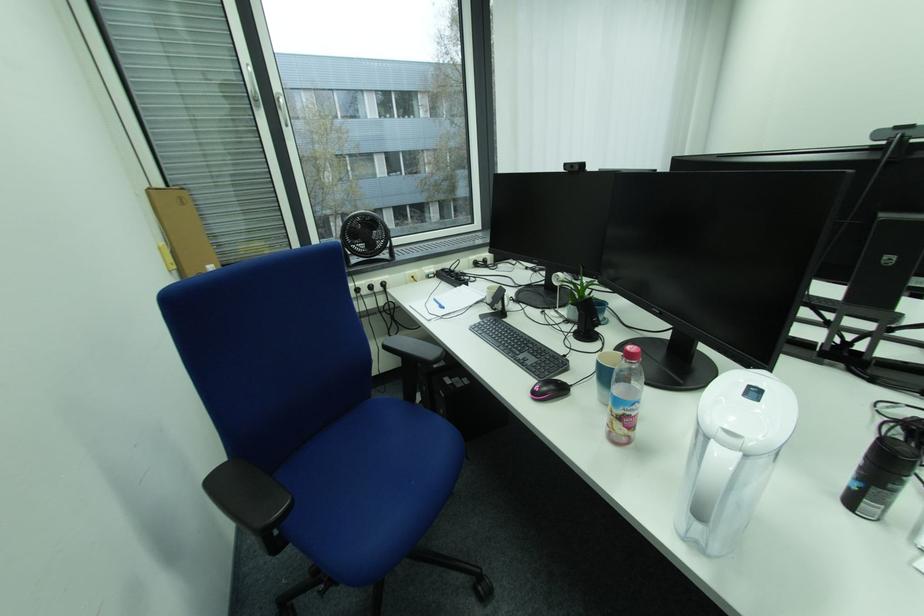
Which object does [438,302] point to?

It corresponds to the black webcam in the image.